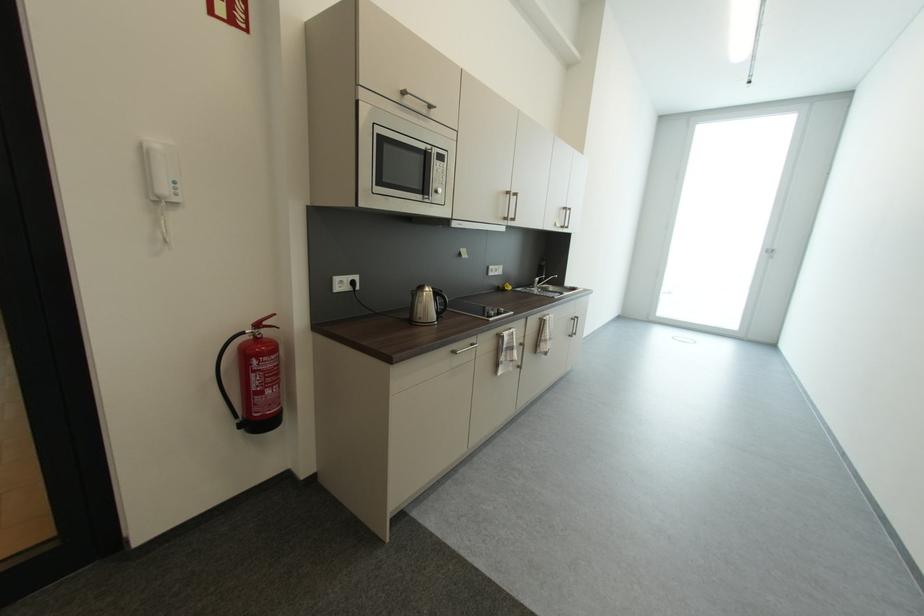
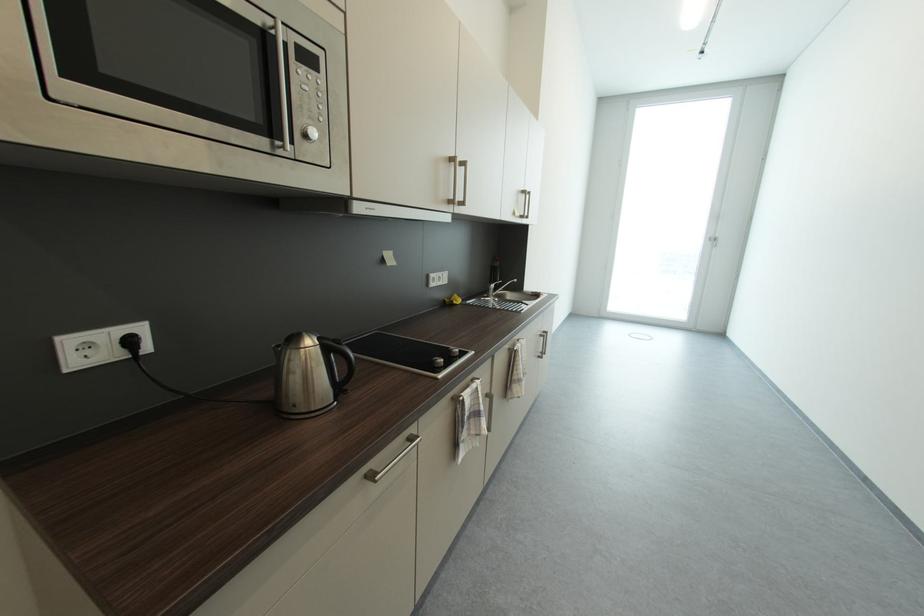
Question: The images are taken continuously from a first-person perspective. In which direction is your viewpoint rotating?

Choices:
 (A) Left
 (B) Right
 (C) Up
 (D) Down

Answer: (B)